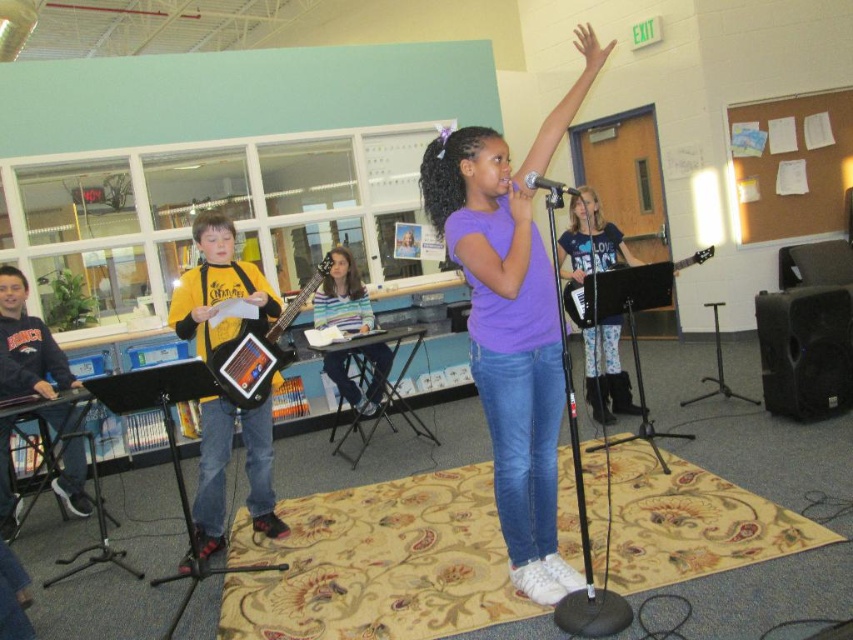
You are standing in the classroom and want to take a photo of both the young girl singing into a microphone and the child playing the electric guitar. Which point, point 1 at coordinates [514,298] or point 2 at coordinates [16,408], should you focus on first to ensure both subjects are in clear focus?

You should focus on point 1 at coordinates [514,298] first because it is closer to the camera than point 2 at coordinates [16,408], ensuring better focus on the foreground subjects.

You are a photographer in the school auditorium and need to capture a group photo of the purple matte shirt at center and the yellow jersey at left. Since you want to ensure both subjects are clearly visible, which subject should you adjust your camera focus to prioritize based on their sizes?

The purple matte shirt at center is wider than the yellow jersey at left, so you should prioritize focusing on the purple matte shirt at center to ensure its details are clear while still capturing the yellow jersey at left in the frame.